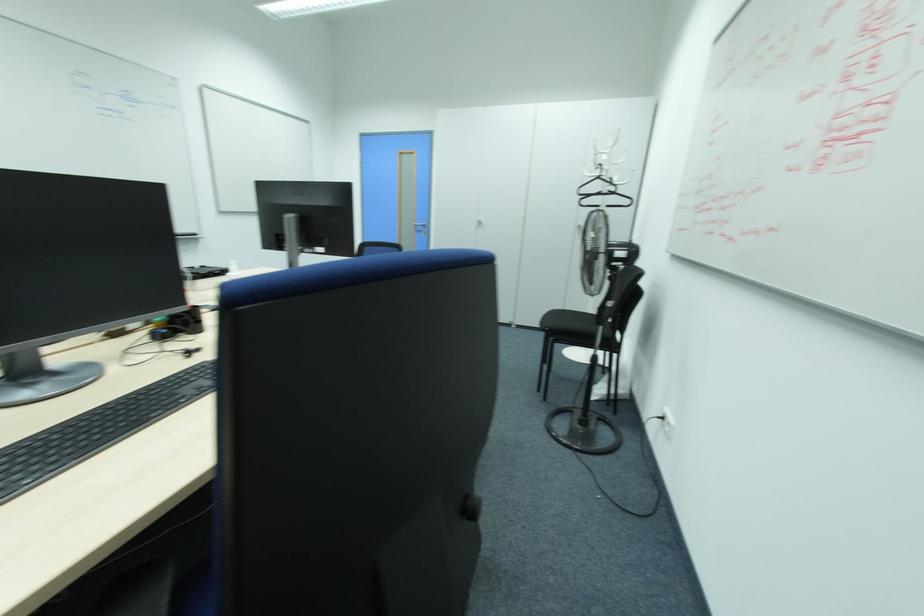
I want to click on black adjustment knob, so click(469, 507).